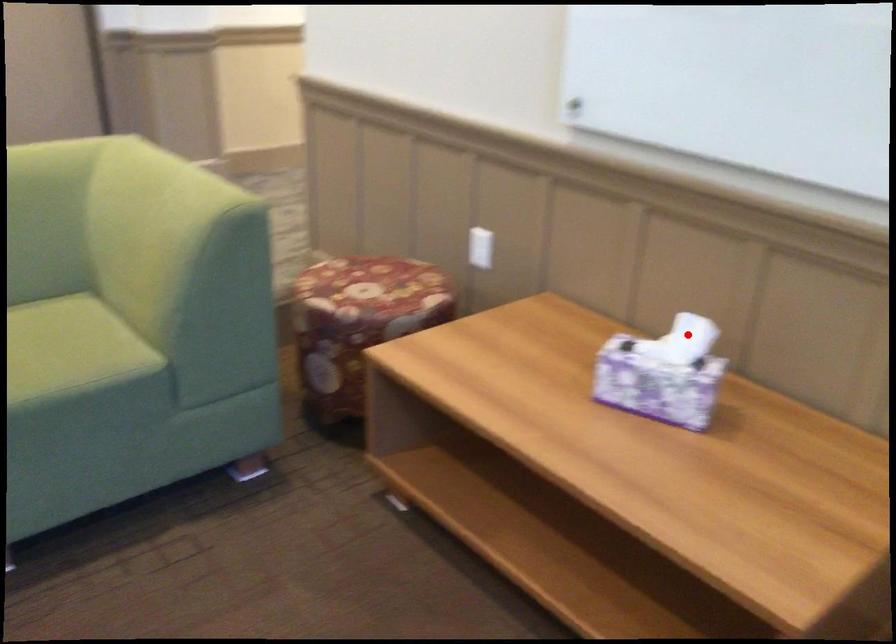
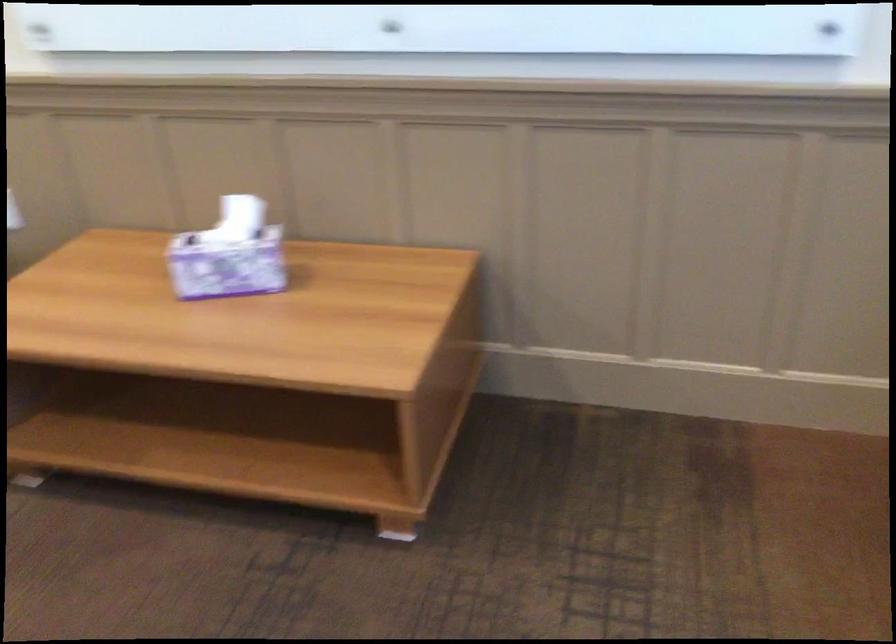
In the second image, find the point that corresponds to the highlighted location in the first image.

(239, 218)